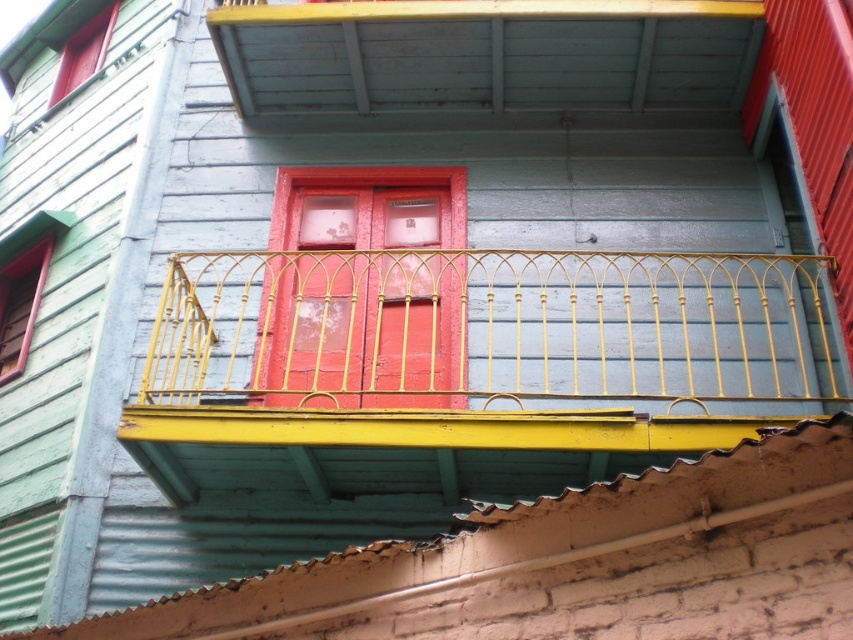
In the scene shown: You are standing in front of a building and see a gold wrought iron balcony at center and a smooth red door at center. Which object is positioned to the right side?

The gold wrought iron balcony at center is to the right of the smooth red door at center, so the gold wrought iron balcony at center is positioned to the right side.